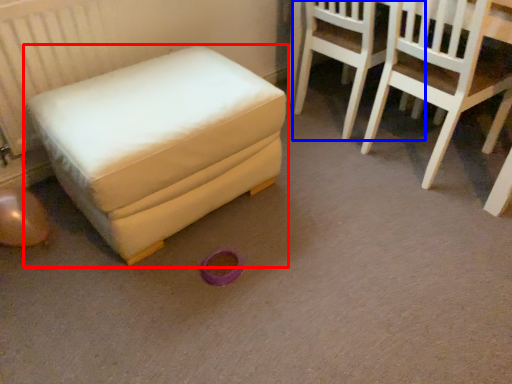
Question: Among these objects, which one is nearest to the camera, furniture (highlighted by a red box) or chair (highlighted by a blue box)?

Choices:
 (A) furniture
 (B) chair

Answer: (A)